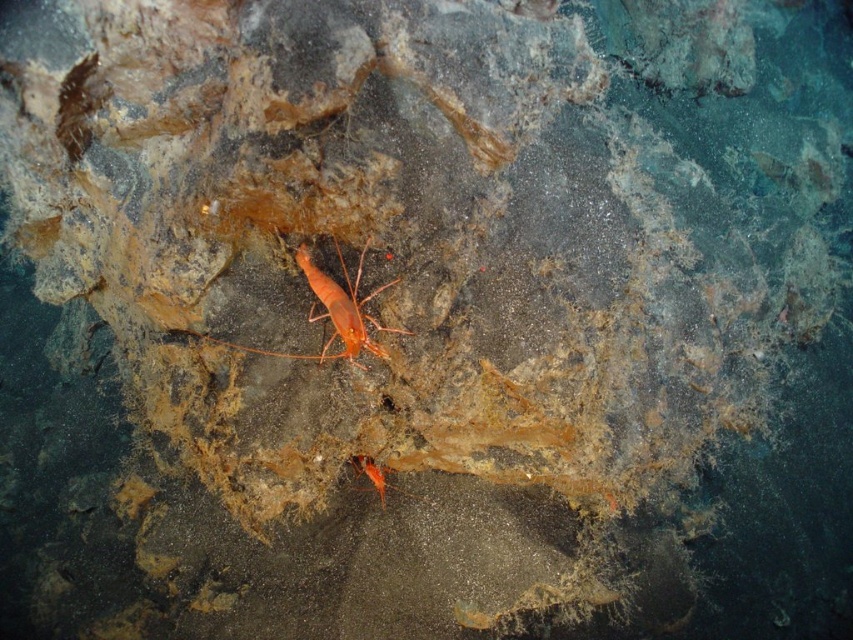
You are a marine biologist observing two orange matte shrimp in an underwater scene. The scene has a dark grayish blue rocky seabed. You need to determine which shrimp is wider. You can see the orange matte shrimp at center and the orange matte shrimp at lower center. Which one has a greater width?

The orange matte shrimp at center has a greater width than the orange matte shrimp at lower center.

You are a marine biologist observing an underwater scene. You notice an orange matte shrimp at center. If you want to collect a sample from it using a tool that has a maximum reach of 1.4 meters, will you be able to do so?

The orange matte shrimp at center is 1.50 meters away from the viewer. Since the tool has a maximum reach of 1.4 meters, it is insufficient to collect the sample from the shrimp.